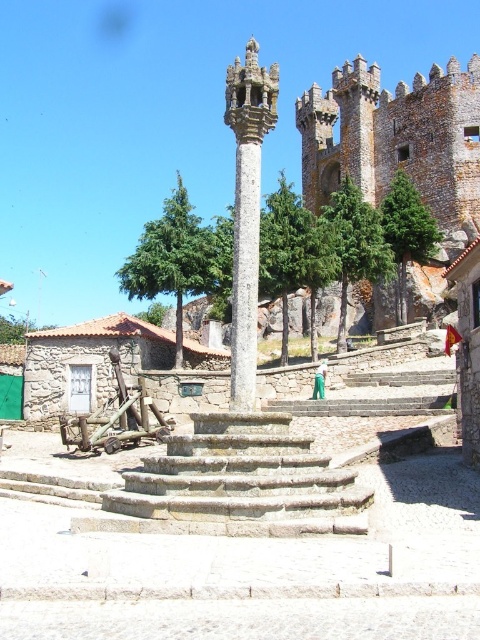
Question: Is stone steps at center wider than stone textured castle at upper right?

Choices:
 (A) yes
 (B) no

Answer: (B)

Question: Does stone steps at center lie behind stone textured castle at upper right?

Choices:
 (A) yes
 (B) no

Answer: (B)

Question: Among these points, which one is farthest from the camera?

Choices:
 (A) (152, 476)
 (B) (303, 138)
 (C) (238, 64)

Answer: (B)

Question: Which of these objects is positioned farthest from the stone steps at center?

Choices:
 (A) stone textured castle at upper right
 (B) smooth stone column at center

Answer: (A)

Question: Which of the following is the closest to the observer?

Choices:
 (A) stone textured castle at upper right
 (B) stone steps at center

Answer: (B)

Question: Is stone textured castle at upper right above smooth stone column at center?

Choices:
 (A) no
 (B) yes

Answer: (B)